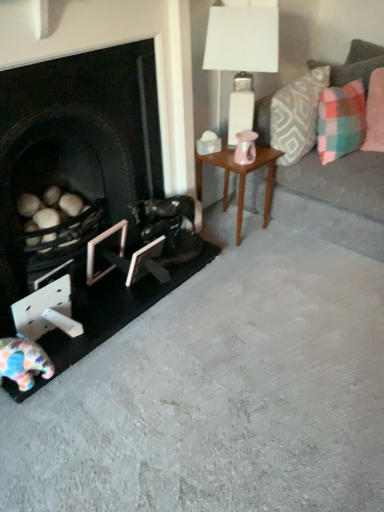
What are the coordinates of `vacant region to the right of white matte picture frame at lower center, the 2th picture frame viewed from the left` in the screenshot? It's located at (176, 275).